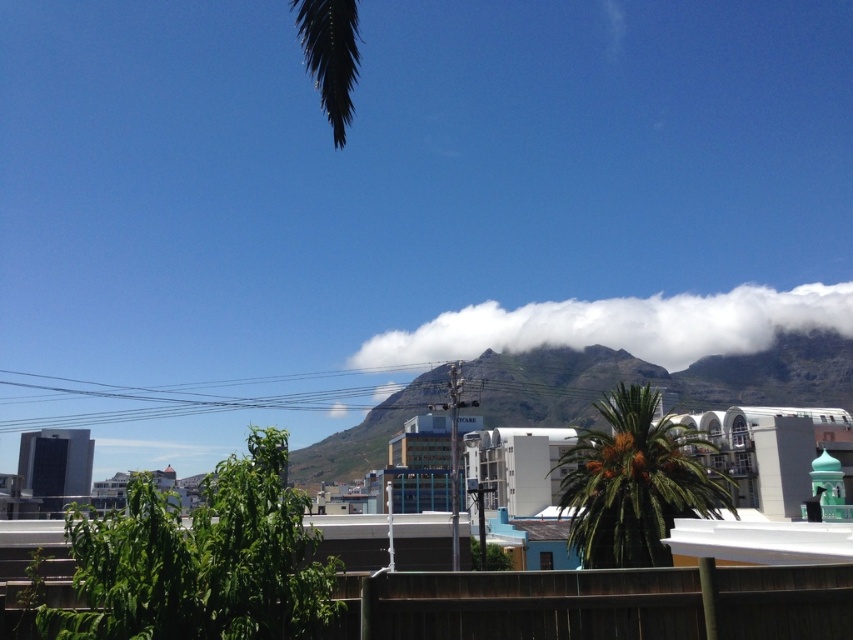
Consider the image. Can you confirm if white fluffy cloud at center is bigger than green leafy palm tree at center?

Correct, white fluffy cloud at center is larger in size than green leafy palm tree at center.

Is point (474, 333) positioned before point (605, 403)?

That is False.

The image size is (853, 640). Identify the location of white fluffy cloud at center. (619, 324).